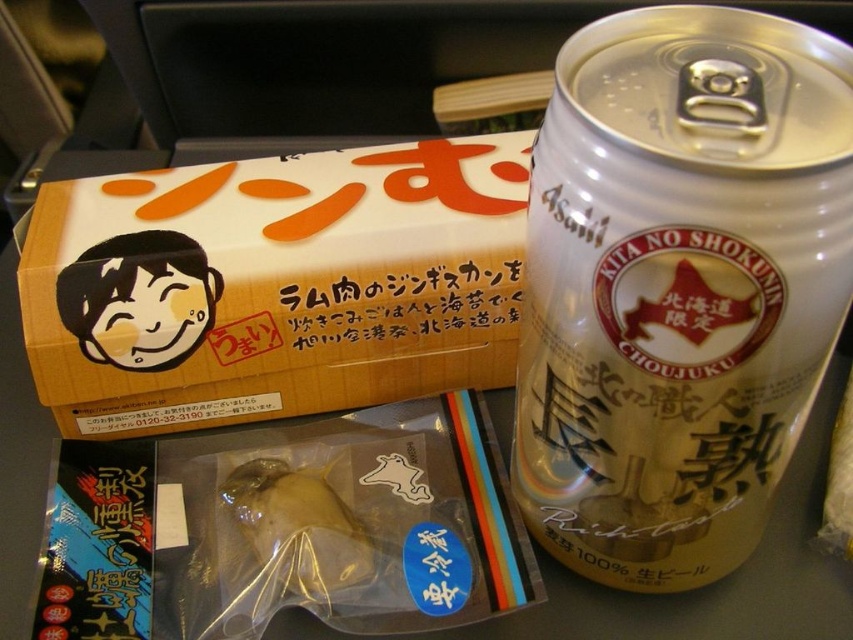
You are a food delivery robot in a train compartment. You need to place a small snack between the gold metallic can at right and the translucent plastic fish at center. The snack is 5 inches long. Is there enough space between them to fit the snack?

The distance between the gold metallic can at right and the translucent plastic fish at center is 10.15 inches. Since the snack is only 5 inches long, there is sufficient space to place it between them.